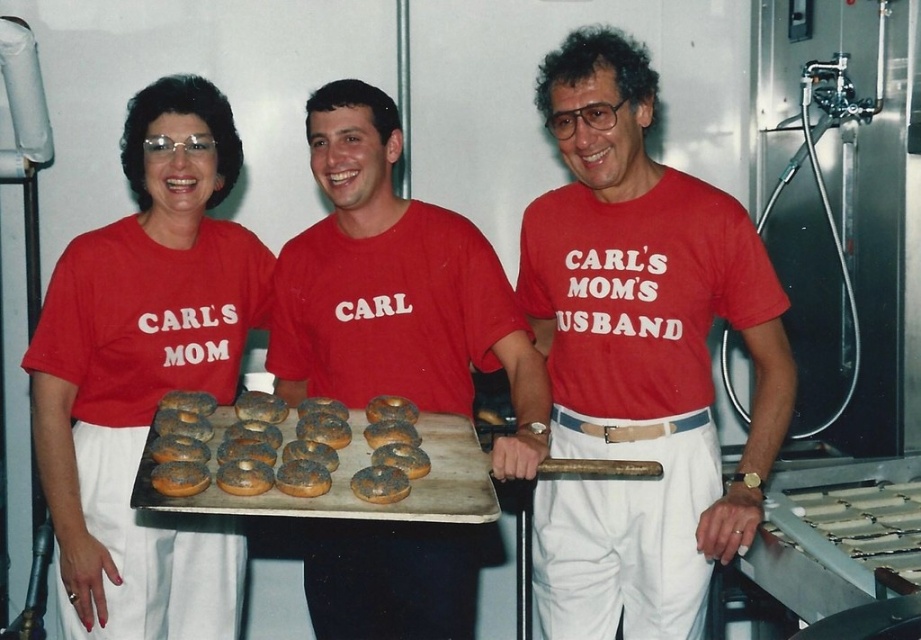
Question: From the image, what is the correct spatial relationship of matte red shirt at left in relation to brown matte bagels at center?

Choices:
 (A) right
 (B) left

Answer: (B)

Question: Which object is farther from the camera taking this photo?

Choices:
 (A) matte red shirt at center
 (B) brown matte bagels at center

Answer: (A)

Question: Is matte red t-shirt at center to the right of brown matte donut at center from the viewer's perspective?

Choices:
 (A) yes
 (B) no

Answer: (A)

Question: Does matte red shirt at left appear over brown matte donut at center?

Choices:
 (A) yes
 (B) no

Answer: (A)

Question: Estimate the real-world distances between objects in this image. Which object is closer to the brown matte donut at center?

Choices:
 (A) brown matte bagels at center
 (B) matte red shirt at center
 (C) matte red t-shirt at center
 (D) matte red shirt at left

Answer: (A)

Question: Which object is farther from the camera taking this photo?

Choices:
 (A) matte red t-shirt at center
 (B) matte red shirt at center
 (C) matte red shirt at left
 (D) brown matte bagels at center

Answer: (C)